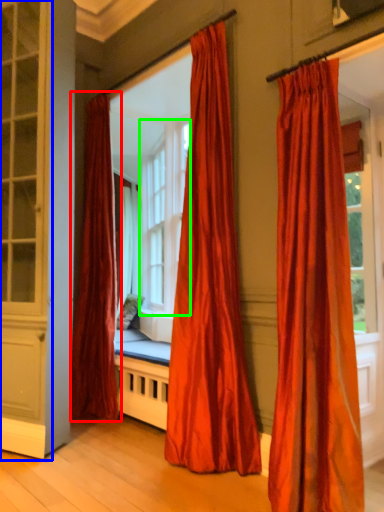
Question: Which object is positioned farthest from curtain (highlighted by a red box)? Select from screen door (highlighted by a blue box) and bay window (highlighted by a green box).

Choices:
 (A) screen door
 (B) bay window

Answer: (B)